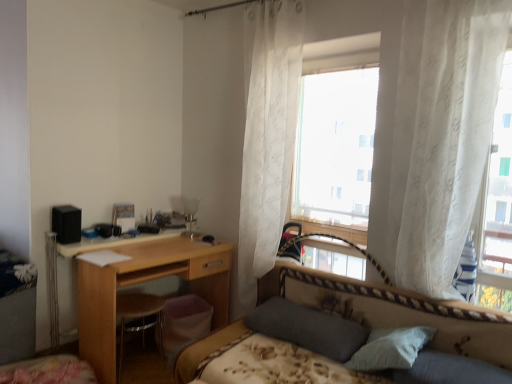
Question: Which direction should I rotate to face white sheer curtains at upper center, which ranks as the first window in back-to-front order, — up or down?

Choices:
 (A) up
 (B) down

Answer: (A)

Question: Is white sheer curtain at center, positioned as the first curtain in left-to-right order, oriented away from floral-patterned fabric bed at center?

Choices:
 (A) no
 (B) yes

Answer: (A)

Question: Considering the relative sizes of white sheer curtain at center, which appears as the second curtain when viewed from the front, and floral-patterned fabric bed at center in the image provided, is white sheer curtain at center, which appears as the second curtain when viewed from the front, wider than floral-patterned fabric bed at center?

Choices:
 (A) yes
 (B) no

Answer: (B)

Question: Can you confirm if white sheer curtain at center, which ranks as the 2th curtain in right-to-left order, is shorter than floral-patterned fabric bed at center?

Choices:
 (A) no
 (B) yes

Answer: (A)

Question: Does white sheer curtain at center, the 1th curtain viewed from the back, have a lesser width compared to floral-patterned fabric bed at center?

Choices:
 (A) yes
 (B) no

Answer: (A)

Question: Is white sheer curtain at center, which ranks as the 2th curtain in right-to-left order, not close to floral-patterned fabric bed at center?

Choices:
 (A) no
 (B) yes

Answer: (A)

Question: From a real-world perspective, is white sheer curtain at center, which ranks as the 2th curtain in right-to-left order, positioned over floral-patterned fabric bed at center based on gravity?

Choices:
 (A) yes
 (B) no

Answer: (A)

Question: Could you tell me if white sheer curtain at upper right, placed as the first curtain when sorted from front to back, is facing white sheer curtain at right, which appears as the 2th window when viewed from the back?

Choices:
 (A) no
 (B) yes

Answer: (B)

Question: From a real-world perspective, does white sheer curtain at upper right, which is the first curtain from right to left, stand above white sheer curtain at right, acting as the second window starting from the left?

Choices:
 (A) yes
 (B) no

Answer: (A)

Question: Can you confirm if white sheer curtain at upper right, the second curtain in the left-to-right sequence, is thinner than white sheer curtain at right, acting as the second window starting from the left?

Choices:
 (A) yes
 (B) no

Answer: (A)

Question: Is white sheer curtain at upper right, positioned as the second curtain in back-to-front order, next to white sheer curtain at right, marked as the 1th window in a right-to-left arrangement?

Choices:
 (A) yes
 (B) no

Answer: (B)

Question: Is white sheer curtain at upper right, positioned as the second curtain in back-to-front order, outside white sheer curtain at right, marked as the 1th window in a right-to-left arrangement?

Choices:
 (A) yes
 (B) no

Answer: (A)

Question: From a real-world perspective, is white sheer curtain at upper right, the second curtain in the left-to-right sequence, positioned under white sheer curtain at right, arranged as the first window when viewed from the front, based on gravity?

Choices:
 (A) no
 (B) yes

Answer: (A)

Question: From the image's perspective, would you say white sheer curtain at center, positioned as the first curtain in left-to-right order, is positioned over white sheer curtains at upper center, which is counted as the 1th window, starting from the left?

Choices:
 (A) no
 (B) yes

Answer: (A)